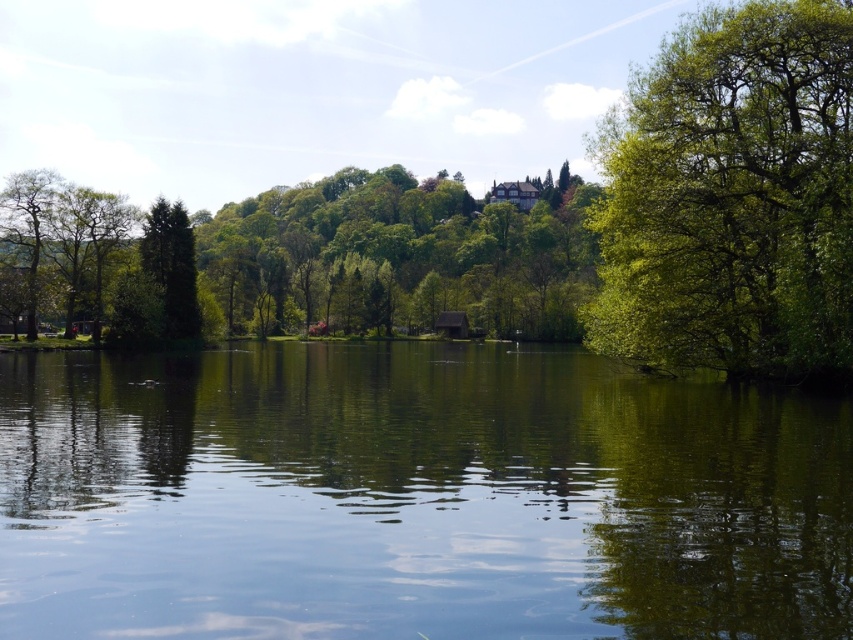
Question: Estimate the real-world distances between objects in this image. Which object is farther from the green leafy tree at left?

Choices:
 (A) green reflective water at center
 (B) green leafy tree at right

Answer: (B)

Question: Does green leafy tree at right have a greater width compared to green leafy tree at left?

Choices:
 (A) yes
 (B) no

Answer: (A)

Question: Is green reflective water at center positioned behind green leafy tree at left?

Choices:
 (A) yes
 (B) no

Answer: (B)

Question: Which object appears farthest from the camera in this image?

Choices:
 (A) green leafy tree at left
 (B) green leafy tree at right
 (C) green reflective water at center

Answer: (A)

Question: Which point is closer to the camera taking this photo?

Choices:
 (A) (16, 216)
 (B) (850, 408)

Answer: (B)

Question: Can you confirm if green reflective water at center is positioned below green leafy tree at left?

Choices:
 (A) no
 (B) yes

Answer: (B)